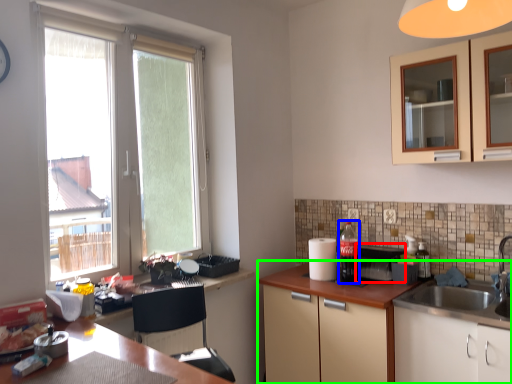
Question: Which object is the closest to the appliance (highlighted by a red box)? Choose among these: beverage (highlighted by a blue box) or cabinetry (highlighted by a green box).

Choices:
 (A) beverage
 (B) cabinetry

Answer: (A)